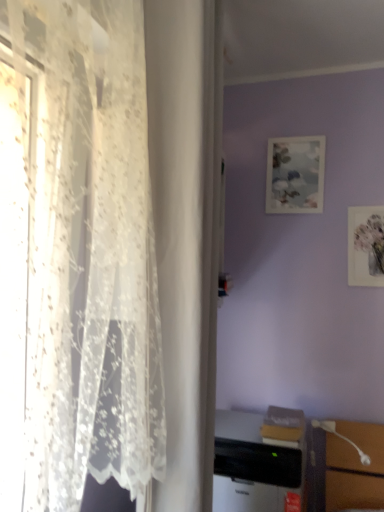
Question: Considering the relative positions of matte paper picture frame at upper right, which is counted as the 2th picture frame, starting from the left, and white glossy table lamp at lower right in the image provided, is matte paper picture frame at upper right, which is counted as the 2th picture frame, starting from the left, to the left of white glossy table lamp at lower right from the viewer's perspective?

Choices:
 (A) yes
 (B) no

Answer: (B)

Question: Is matte paper picture frame at upper right, the 1th picture frame viewed from the front, facing towards white glossy table lamp at lower right?

Choices:
 (A) no
 (B) yes

Answer: (A)

Question: Is matte paper picture frame at upper right, which ranks as the 2th picture frame in back-to-front order, taller than white glossy table lamp at lower right?

Choices:
 (A) yes
 (B) no

Answer: (A)

Question: Is matte paper picture frame at upper right, arranged as the first picture frame when viewed from the right, facing away from white glossy table lamp at lower right?

Choices:
 (A) no
 (B) yes

Answer: (A)

Question: Is the depth of matte paper picture frame at upper right, marked as the 1th picture frame in a bottom-to-top arrangement, less than that of white glossy table lamp at lower right?

Choices:
 (A) no
 (B) yes

Answer: (A)

Question: Is matte paper picture frame at upper right, which is counted as the 2th picture frame, starting from the left, far away from white glossy table lamp at lower right?

Choices:
 (A) yes
 (B) no

Answer: (B)

Question: Considering the relative sizes of matte paper picture frame at upper center, the first picture frame when ordered from back to front, and black plastic desktop computer at lower center in the image provided, is matte paper picture frame at upper center, the first picture frame when ordered from back to front, bigger than black plastic desktop computer at lower center?

Choices:
 (A) yes
 (B) no

Answer: (B)

Question: Is matte paper picture frame at upper center, the second picture frame when ordered from bottom to top, beside black plastic desktop computer at lower center?

Choices:
 (A) yes
 (B) no

Answer: (B)

Question: From the image's perspective, is matte paper picture frame at upper center, which is counted as the first picture frame, starting from the left, beneath black plastic desktop computer at lower center?

Choices:
 (A) yes
 (B) no

Answer: (B)

Question: Can black plastic desktop computer at lower center be found inside matte paper picture frame at upper center, the first picture frame when ordered from back to front?

Choices:
 (A) no
 (B) yes

Answer: (A)

Question: Is matte paper picture frame at upper center, which is the first picture frame from top to bottom, shorter than black plastic desktop computer at lower center?

Choices:
 (A) yes
 (B) no

Answer: (B)

Question: Is matte paper picture frame at upper center, the second picture frame when ordered from bottom to top, in front of black plastic desktop computer at lower center?

Choices:
 (A) yes
 (B) no

Answer: (B)

Question: From the image's perspective, does matte paper picture frame at upper right, which ranks as the 2th picture frame in back-to-front order, appear lower than matte paper picture frame at upper center, the 2th picture frame from the right?

Choices:
 (A) no
 (B) yes

Answer: (B)